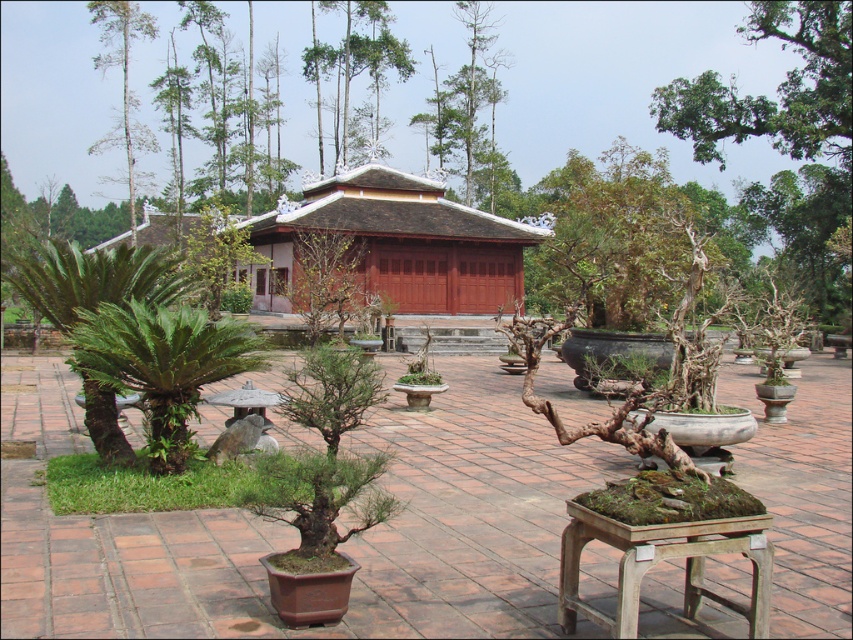
Question: Is brown clay pot at center positioned behind smooth bark tree at upper left?

Choices:
 (A) no
 (B) yes

Answer: (A)

Question: Considering the real-world distances, which object is farthest from the brown clay pot at center?

Choices:
 (A) smooth bark tree at upper left
 (B) green leafy tree at upper right
 (C) matte wood hut at center
 (D) brown textured bonsai at upper right

Answer: (A)

Question: Is brown clay pot at center thinner than brown textured bonsai at upper right?

Choices:
 (A) no
 (B) yes

Answer: (B)

Question: Which object is the closest to the brown clay pot at center?

Choices:
 (A) brown textured bonsai at upper right
 (B) matte wood hut at center

Answer: (A)

Question: Is brown clay pot at center above smooth bark tree at upper left?

Choices:
 (A) yes
 (B) no

Answer: (B)

Question: Estimate the real-world distances between objects in this image. Which object is farther from the brown textured bonsai at upper right?

Choices:
 (A) smooth bark tree at upper left
 (B) green leafy tree at upper right
 (C) matte wood hut at center
 (D) brown clay pot at center

Answer: (A)